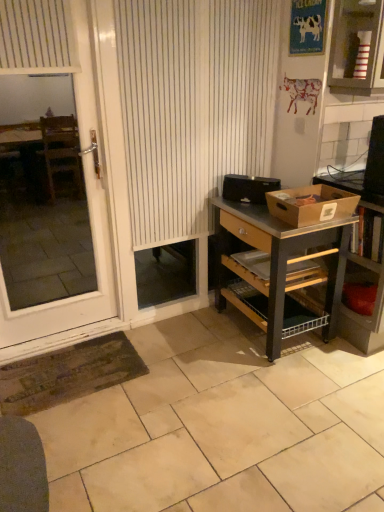
Locate an element on the screen. The height and width of the screenshot is (512, 384). brown cardboard box at right, which is counted as the 1th box, starting from the front is located at coordinates (311, 204).

Where is `wooden shelf at right`? This screenshot has width=384, height=512. wooden shelf at right is located at coordinates (363, 264).

What is the approximate width of black plastic toaster at center, positioned as the second box in front-to-back order?

It is 5.87 inches.

Describe the element at coordinates (248, 188) in the screenshot. I see `black plastic toaster at center, positioned as the second box in front-to-back order` at that location.

What do you see at coordinates (285, 256) in the screenshot? I see `wooden desk at right` at bounding box center [285, 256].

The width and height of the screenshot is (384, 512). What do you see at coordinates (71, 297) in the screenshot? I see `white glossy screen door at left` at bounding box center [71, 297].

The width and height of the screenshot is (384, 512). In order to click on striped cardboard box at upper right in this screenshot , I will do `click(357, 48)`.

Is white glossy screen door at left to the right of wooden shelf at right from the viewer's perspective?

No, white glossy screen door at left is not to the right of wooden shelf at right.

Could you tell me if white glossy screen door at left is facing wooden shelf at right?

No, white glossy screen door at left is not turned towards wooden shelf at right.

Locate an element on the screen. The image size is (384, 512). shelf located underneath the white glossy screen door at left (from a real-world perspective) is located at coordinates (363, 264).

Which of these two, white glossy screen door at left or wooden shelf at right, stands shorter?

wooden shelf at right.

From the image's perspective, is striped cardboard box at upper right beneath white glossy screen door at left?

Actually, striped cardboard box at upper right appears above white glossy screen door at left in the image.

Which is less distant, (352, 52) or (97, 256)?

Point (352, 52) is positioned closer to the camera compared to point (97, 256).

This screenshot has height=512, width=384. In the image, there is a striped cardboard box at upper right. What are the coordinates of `screen door below it (from a real-world perspective)` in the screenshot? It's located at (71, 297).

Is wooden desk at right touching beige tile at lower center?

They are not placed beside each other.

From the image's perspective, is wooden desk at right above or below beige tile at lower center?

wooden desk at right is situated higher than beige tile at lower center in the image.

From the picture: How different are the orientations of wooden desk at right and beige tile at lower center in degrees?

The angle between the facing direction of wooden desk at right and the facing direction of beige tile at lower center is 92.1 degrees.

Is white glossy screen door at left oriented towards beige tile at lower center?

No, white glossy screen door at left is not turned towards beige tile at lower center.

Between white glossy screen door at left and beige tile at lower center, which one is positioned in front?

beige tile at lower center is closer to the camera.

Is white glossy screen door at left next to beige tile at lower center?

No, white glossy screen door at left is not making contact with beige tile at lower center.

Would you say beige tile at lower center is part of white glossy screen door at left's contents?

That's incorrect, beige tile at lower center is not inside white glossy screen door at left.

Considering the sizes of objects striped cardboard box at upper right and beige tile at lower center in the image provided, who is smaller, striped cardboard box at upper right or beige tile at lower center?

Smaller between the two is striped cardboard box at upper right.

Is striped cardboard box at upper right placed right next to beige tile at lower center?

No, striped cardboard box at upper right is not touching beige tile at lower center.

Would you say striped cardboard box at upper right contains beige tile at lower center?

Definitely not — beige tile at lower center is not inside striped cardboard box at upper right.

Where is `cabinetry located above the beige tile at lower center (from a real-world perspective)`? The height and width of the screenshot is (512, 384). cabinetry located above the beige tile at lower center (from a real-world perspective) is located at coordinates (357, 48).

Considering the relative sizes of white striped curtain at center and white glossy screen door at left in the image provided, is white striped curtain at center shorter than white glossy screen door at left?

Yes, white striped curtain at center is shorter than white glossy screen door at left.

Is white striped curtain at center further to the viewer compared to white glossy screen door at left?

Yes, white striped curtain at center is further from the camera.

Between white striped curtain at center and white glossy screen door at left, which one has smaller width?

Thinner between the two is white glossy screen door at left.

In the image, is white striped curtain at center on the left side or the right side of white glossy screen door at left?

Clearly, white striped curtain at center is on the right of white glossy screen door at left in the image.

From the image's perspective, does beige tile at lower center appear higher than brown cardboard box at right, placed as the 2th box when sorted from back to front?

No.

Is beige tile at lower center taller than brown cardboard box at right, which is counted as the 1th box, starting from the front?

No.

Would you say beige tile at lower center is outside brown cardboard box at right, placed as the 2th box when sorted from back to front?

Yes, beige tile at lower center is outside of brown cardboard box at right, placed as the 2th box when sorted from back to front.

Where is `tile below the brown cardboard box at right, which is counted as the 1th box, starting from the front (from a real-world perspective)`? The height and width of the screenshot is (512, 384). tile below the brown cardboard box at right, which is counted as the 1th box, starting from the front (from a real-world perspective) is located at coordinates (223, 426).

Identify the location of screen door above the wooden shelf at right (from the image's perspective). Image resolution: width=384 pixels, height=512 pixels. pos(71,297).

Identify the location of cabinetry behind the white glossy screen door at left. Image resolution: width=384 pixels, height=512 pixels. (357, 48).

When comparing their distances from striped cardboard box at upper right, does white striped curtain at center or black plastic toaster at center, positioned as the second box in front-to-back order, seem further?

black plastic toaster at center, positioned as the second box in front-to-back order, is further to striped cardboard box at upper right.

Looking at the image, which one is located closer to white striped curtain at center, wooden desk at right or striped cardboard box at upper right?

wooden desk at right is closer to white striped curtain at center.

Which object lies nearer to the anchor point wooden desk at right, striped cardboard box at upper right or wooden shelf at right?

wooden shelf at right is positioned closer to the anchor wooden desk at right.

Looking at the image, which one is located further to white striped curtain at center, brown cardboard box at right, which is counted as the 1th box, starting from the front, or wooden shelf at right?

wooden shelf at right is positioned further to the anchor white striped curtain at center.

Based on their spatial positions, is black plastic toaster at center, the first box positioned from the back, or beige tile at lower center further from wooden shelf at right?

beige tile at lower center.

Estimate the real-world distances between objects in this image. Which object is further from beige tile at lower center, striped cardboard box at upper right or wooden desk at right?

striped cardboard box at upper right.

Based on their spatial positions, is wooden shelf at right or brown cardboard box at right, placed as the 2th box when sorted from back to front, closer to beige tile at lower center?

Based on the image, wooden shelf at right appears to be nearer to beige tile at lower center.

Estimate the real-world distances between objects in this image. Which object is closer to black plastic toaster at center, positioned as the second box in front-to-back order, wooden desk at right or brown cardboard box at right, placed as the 2th box when sorted from back to front?

Based on the image, brown cardboard box at right, placed as the 2th box when sorted from back to front, appears to be nearer to black plastic toaster at center, positioned as the second box in front-to-back order.

This screenshot has width=384, height=512. What are the coordinates of `tile between white glossy screen door at left and wooden shelf at right from left to right` in the screenshot? It's located at (223, 426).

Where is `box that lies between black plastic toaster at center, positioned as the second box in front-to-back order, and wooden desk at right from top to bottom`? The width and height of the screenshot is (384, 512). box that lies between black plastic toaster at center, positioned as the second box in front-to-back order, and wooden desk at right from top to bottom is located at coordinates (311, 204).

At what (x,y) coordinates should I click in order to perform the action: click on box between white glossy screen door at left and wooden desk at right in the horizontal direction. Please return your answer as a coordinate pair (x, y). The height and width of the screenshot is (512, 384). Looking at the image, I should click on (248, 188).

The width and height of the screenshot is (384, 512). Identify the location of curtain located between white glossy screen door at left and brown cardboard box at right, which is counted as the 1th box, starting from the front, in the left-right direction. (193, 105).